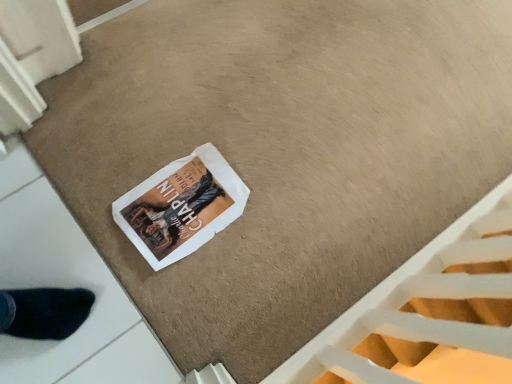
This screenshot has width=512, height=384. Find the location of `vacant area situated below white paper magazine at center (from a real-world perspective)`. vacant area situated below white paper magazine at center (from a real-world perspective) is located at coordinates (187, 211).